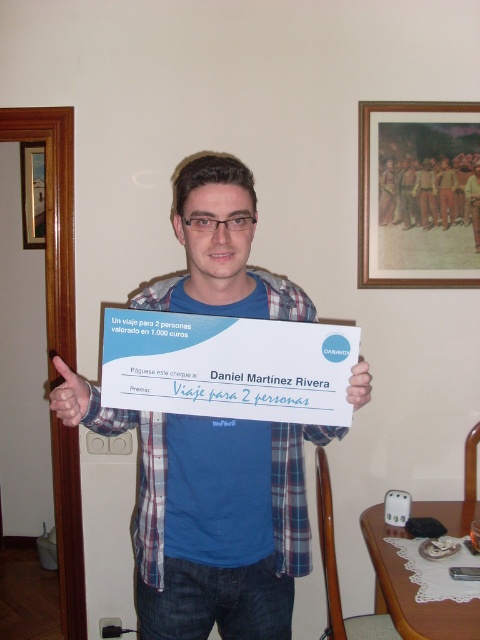
Who is positioned more to the left, wooden picture frame at left or matte blue thumb at upper left?

From the viewer's perspective, wooden picture frame at left appears more on the left side.

You are a GUI agent. You are given a task and a screenshot of the screen. Output one action in this format:
    pyautogui.click(x=<x>, y=<y>)
    Task: Click on the wooden picture frame at left
    The image size is (480, 640).
    Given the screenshot: What is the action you would take?
    33,195

Is point (28, 172) positioned in front of point (67, 387)?

No.

Where is `wooden picture frame at left`? wooden picture frame at left is located at coordinates (33, 195).

Is point (470, 218) positioned before point (351, 394)?

No, (470, 218) is further to viewer.

Does wooden picture frame at upper right appear on the left side of white paper at center?

No, wooden picture frame at upper right is not to the left of white paper at center.

In order to click on wooden picture frame at upper right in this screenshot , I will do `click(419, 195)`.

Is point (164, 518) positioned after point (25, 198)?

No, (164, 518) is in front of (25, 198).

Is blue plaid shirt at center smaller than wooden picture frame at left?

No, blue plaid shirt at center is not smaller than wooden picture frame at left.

Does point (331, 428) come closer to viewer compared to point (29, 220)?

Yes.

The image size is (480, 640). In order to click on blue plaid shirt at center in this screenshot , I will do `click(216, 522)`.